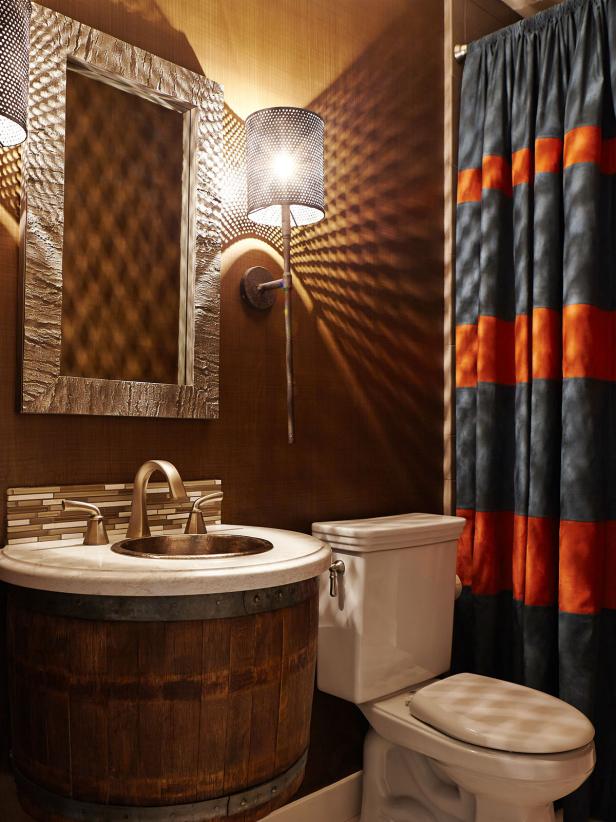
At what (x,y) coordinates should I click in order to perform the action: click on shower curtain. Please return your answer as a coordinate pair (x, y). The height and width of the screenshot is (822, 616). Looking at the image, I should click on (573, 481).